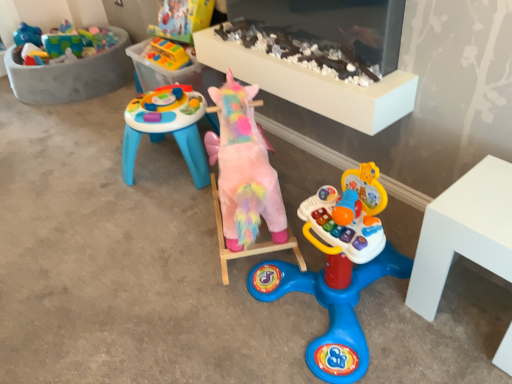
Measure the distance between point [234,83] and camera.

Point [234,83] is 1.73 meters from camera.

What is the approximate height of rubberized plastic toy at upper center, which is the 1th toy in top-to-bottom order?

4.42 inches.

Where is `fluffy pink unicorn at center, which is the 1th toy from bottom to top`? fluffy pink unicorn at center, which is the 1th toy from bottom to top is located at coordinates (244, 179).

From a real-world perspective, which toy is the 2nd one above the fluffy pink unicorn at center, the third toy positioned from the top? Please provide its 2D coordinates.

[(307, 50)]

Considering the relative sizes of pastel plush unicorn at center, marked as the second toy in a bottom-to-top arrangement, and fluffy pink unicorn at center, the third toy positioned from the top, in the image provided, is pastel plush unicorn at center, marked as the second toy in a bottom-to-top arrangement, wider than fluffy pink unicorn at center, the third toy positioned from the top,?

In fact, pastel plush unicorn at center, marked as the second toy in a bottom-to-top arrangement, might be narrower than fluffy pink unicorn at center, the third toy positioned from the top.

Which is in front, point (266, 39) or point (255, 170)?

Positioned in front is point (255, 170).

Based on the photo, considering the sizes of objects pastel plush unicorn at center, positioned as the 2th toy in top-to-bottom order, and fluffy pink unicorn at center, the third toy positioned from the top, in the image provided, who is bigger, pastel plush unicorn at center, positioned as the 2th toy in top-to-bottom order, or fluffy pink unicorn at center, the third toy positioned from the top,?

fluffy pink unicorn at center, the third toy positioned from the top.

Would you consider fluffy pink unicorn at center, the third toy positioned from the top, to be distant from pastel plush unicorn at center, positioned as the 2th toy in top-to-bottom order?

They are positioned close to each other.

Is fluffy pink unicorn at center, the third toy positioned from the top, oriented towards pastel plush unicorn at center, positioned as the 2th toy in top-to-bottom order?

No.

Looking at this image, is fluffy pink unicorn at center, which is the 1th toy from bottom to top, taller or shorter than pastel plush unicorn at center, marked as the second toy in a bottom-to-top arrangement?

In the image, fluffy pink unicorn at center, which is the 1th toy from bottom to top, appears to be taller than pastel plush unicorn at center, marked as the second toy in a bottom-to-top arrangement.

Measure the distance from fluffy pink unicorn at center, the third toy positioned from the top, to pastel plush unicorn at center, marked as the second toy in a bottom-to-top arrangement.

The distance of fluffy pink unicorn at center, the third toy positioned from the top, from pastel plush unicorn at center, marked as the second toy in a bottom-to-top arrangement, is 44.92 centimeters.

Is the position of rubberized plastic toy at upper center, acting as the third toy starting from the bottom, less distant than that of fluffy pink unicorn at center, which is the 1th toy from bottom to top?

No.

In terms of size, does rubberized plastic toy at upper center, acting as the third toy starting from the bottom, appear bigger or smaller than fluffy pink unicorn at center, the third toy positioned from the top?

Clearly, rubberized plastic toy at upper center, acting as the third toy starting from the bottom, is smaller in size than fluffy pink unicorn at center, the third toy positioned from the top.

Is point (162, 47) positioned behind point (238, 143)?

Yes.

Is rubberized plastic toy at upper center, which is the 1th toy in top-to-bottom order, beside fluffy pink unicorn at center, which is the 1th toy from bottom to top?

There is a gap between rubberized plastic toy at upper center, which is the 1th toy in top-to-bottom order, and fluffy pink unicorn at center, which is the 1th toy from bottom to top.

Which of these two, pastel plush unicorn at center, positioned as the 2th toy in top-to-bottom order, or rubberized plastic toy at upper center, acting as the third toy starting from the bottom, stands shorter?

rubberized plastic toy at upper center, acting as the third toy starting from the bottom, is shorter.

Can you confirm if pastel plush unicorn at center, marked as the second toy in a bottom-to-top arrangement, is positioned to the right of rubberized plastic toy at upper center, acting as the third toy starting from the bottom?

Yes.

Between pastel plush unicorn at center, marked as the second toy in a bottom-to-top arrangement, and rubberized plastic toy at upper center, which is the 1th toy in top-to-bottom order, which one has smaller width?

pastel plush unicorn at center, marked as the second toy in a bottom-to-top arrangement.

In terms of width, does fluffy pink unicorn at center, the third toy positioned from the top, look wider or thinner when compared to rubberized plastic toy at upper center, acting as the third toy starting from the bottom?

Clearly, fluffy pink unicorn at center, the third toy positioned from the top, has more width compared to rubberized plastic toy at upper center, acting as the third toy starting from the bottom.

In the scene shown: Could you tell me if fluffy pink unicorn at center, which is the 1th toy from bottom to top, is facing rubberized plastic toy at upper center, acting as the third toy starting from the bottom?

No, fluffy pink unicorn at center, which is the 1th toy from bottom to top, is not aimed at rubberized plastic toy at upper center, acting as the third toy starting from the bottom.

Consider the image. Is fluffy pink unicorn at center, which is the 1th toy from bottom to top, to the left of rubberized plastic toy at upper center, which is the 1th toy in top-to-bottom order, from the viewer's perspective?

Incorrect, fluffy pink unicorn at center, which is the 1th toy from bottom to top, is not on the left side of rubberized plastic toy at upper center, which is the 1th toy in top-to-bottom order.

How much distance is there between fluffy pink unicorn at center, which is the 1th toy from bottom to top, and rubberized plastic toy at upper center, which is the 1th toy in top-to-bottom order?

35.01 inches.

Is rubberized plastic toy at upper center, which is the 1th toy in top-to-bottom order, placed right next to pastel plush unicorn at center, positioned as the 2th toy in top-to-bottom order?

No, rubberized plastic toy at upper center, which is the 1th toy in top-to-bottom order, is not beside pastel plush unicorn at center, positioned as the 2th toy in top-to-bottom order.

From the image's perspective, who appears lower, rubberized plastic toy at upper center, acting as the third toy starting from the bottom, or pastel plush unicorn at center, marked as the second toy in a bottom-to-top arrangement?

pastel plush unicorn at center, marked as the second toy in a bottom-to-top arrangement, appears lower in the image.

From a real-world perspective, is rubberized plastic toy at upper center, acting as the third toy starting from the bottom, physically located above or below pastel plush unicorn at center, positioned as the 2th toy in top-to-bottom order?

From a real-world perspective, rubberized plastic toy at upper center, acting as the third toy starting from the bottom, is physically below pastel plush unicorn at center, positioned as the 2th toy in top-to-bottom order.

Considering the relative sizes of rubberized plastic toy at upper center, which is the 1th toy in top-to-bottom order, and pastel plush unicorn at center, marked as the second toy in a bottom-to-top arrangement, in the image provided, is rubberized plastic toy at upper center, which is the 1th toy in top-to-bottom order, taller than pastel plush unicorn at center, marked as the second toy in a bottom-to-top arrangement,?

In fact, rubberized plastic toy at upper center, which is the 1th toy in top-to-bottom order, may be shorter than pastel plush unicorn at center, marked as the second toy in a bottom-to-top arrangement.

Where is `toy on the right side of fluffy pink unicorn at center, which is the 1th toy from bottom to top`? This screenshot has height=384, width=512. toy on the right side of fluffy pink unicorn at center, which is the 1th toy from bottom to top is located at coordinates (307, 50).

Find the location of a particular element. toy that is the 2nd object above the fluffy pink unicorn at center, the third toy positioned from the top (from a real-world perspective) is located at coordinates (307, 50).

When comparing their distances from rubberized plastic toy at upper center, acting as the third toy starting from the bottom, does fluffy pink unicorn at center, the third toy positioned from the top, or pastel plush unicorn at center, marked as the second toy in a bottom-to-top arrangement, seem closer?

Based on the image, pastel plush unicorn at center, marked as the second toy in a bottom-to-top arrangement, appears to be nearer to rubberized plastic toy at upper center, acting as the third toy starting from the bottom.

From the image, which object appears to be nearer to fluffy pink unicorn at center, the third toy positioned from the top, pastel plush unicorn at center, marked as the second toy in a bottom-to-top arrangement, or rubberized plastic toy at upper center, acting as the third toy starting from the bottom?

pastel plush unicorn at center, marked as the second toy in a bottom-to-top arrangement, lies closer to fluffy pink unicorn at center, the third toy positioned from the top, than the other object.

Which object lies nearer to the anchor point pastel plush unicorn at center, marked as the second toy in a bottom-to-top arrangement, fluffy pink unicorn at center, which is the 1th toy from bottom to top, or rubberized plastic toy at upper center, which is the 1th toy in top-to-bottom order?

Among the two, fluffy pink unicorn at center, which is the 1th toy from bottom to top, is located nearer to pastel plush unicorn at center, marked as the second toy in a bottom-to-top arrangement.

Considering their positions, is rubberized plastic toy at upper center, which is the 1th toy in top-to-bottom order, positioned closer to fluffy pink unicorn at center, the third toy positioned from the top, than pastel plush unicorn at center, positioned as the 2th toy in top-to-bottom order?

The object closer to fluffy pink unicorn at center, the third toy positioned from the top, is pastel plush unicorn at center, positioned as the 2th toy in top-to-bottom order.

Looking at the image, which one is located further to pastel plush unicorn at center, marked as the second toy in a bottom-to-top arrangement, rubberized plastic toy at upper center, which is the 1th toy in top-to-bottom order, or fluffy pink unicorn at center, which is the 1th toy from bottom to top?

rubberized plastic toy at upper center, which is the 1th toy in top-to-bottom order, is positioned further to the anchor pastel plush unicorn at center, marked as the second toy in a bottom-to-top arrangement.

Estimate the real-world distances between objects in this image. Which object is further from rubberized plastic toy at upper center, acting as the third toy starting from the bottom, pastel plush unicorn at center, positioned as the 2th toy in top-to-bottom order, or fluffy pink unicorn at center, which is the 1th toy from bottom to top?

fluffy pink unicorn at center, which is the 1th toy from bottom to top, lies further to rubberized plastic toy at upper center, acting as the third toy starting from the bottom, than the other object.

Find the location of a particular element. This screenshot has height=384, width=512. toy between fluffy pink unicorn at center, the third toy positioned from the top, and rubberized plastic toy at upper center, acting as the third toy starting from the bottom, in the front-back direction is located at coordinates (307, 50).